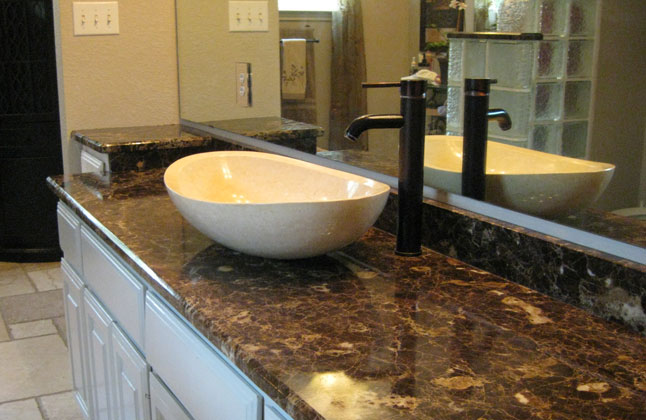
Find the location of a particular element. The image size is (646, 420). light switches is located at coordinates (84, 21), (97, 20), (109, 21).